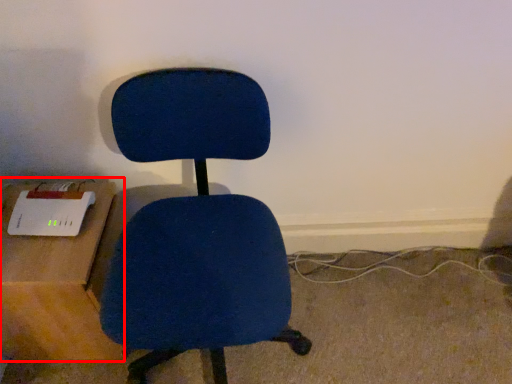
Question: Considering the relative positions of table (annotated by the red box) and chair in the image provided, where is table (annotated by the red box) located with respect to the staircase?

Choices:
 (A) right
 (B) left

Answer: (B)